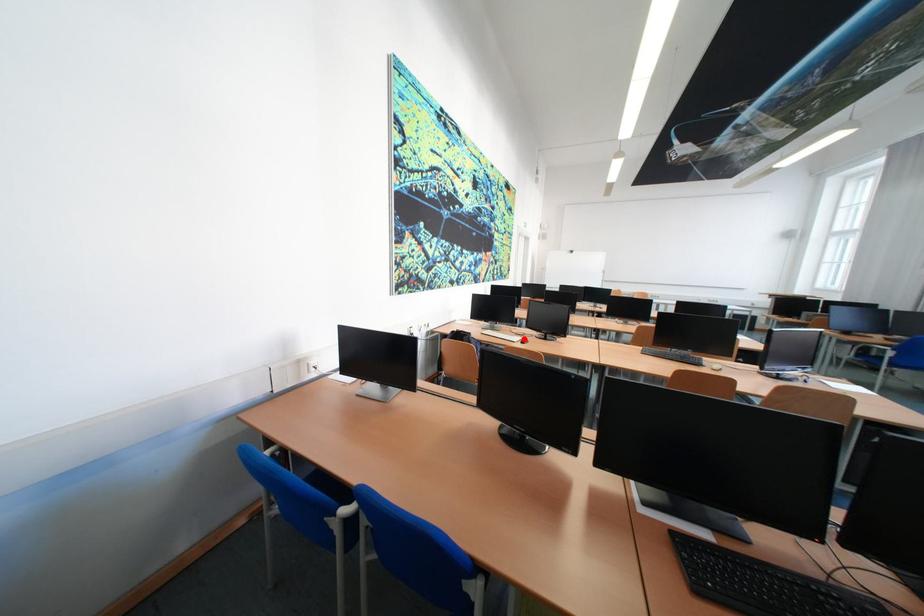
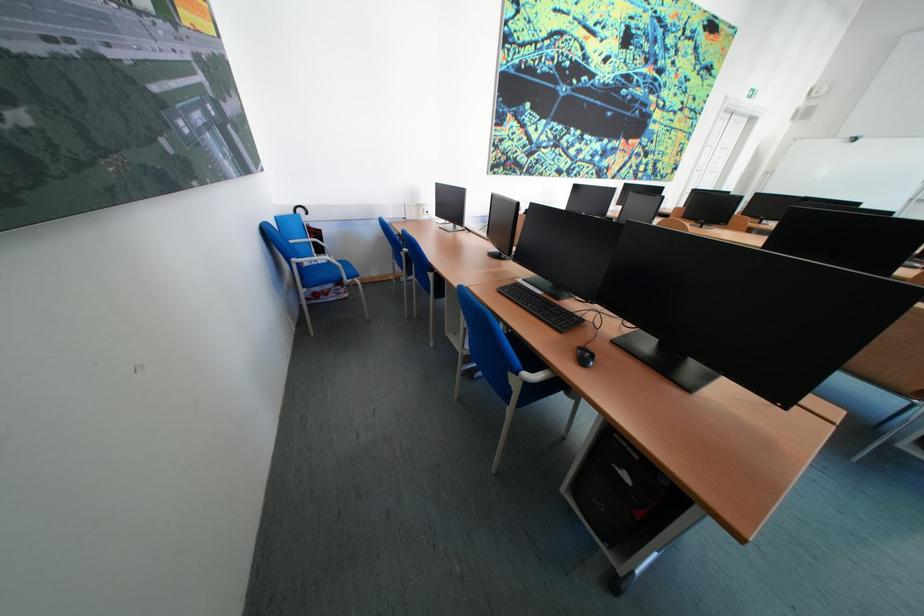
Question: I am providing you with two images of the same scene from different viewpoints. A red point is marked on the first image. Is the red point's position out of view in image 2?

Choices:
 (A) Yes
 (B) No

Answer: (A)